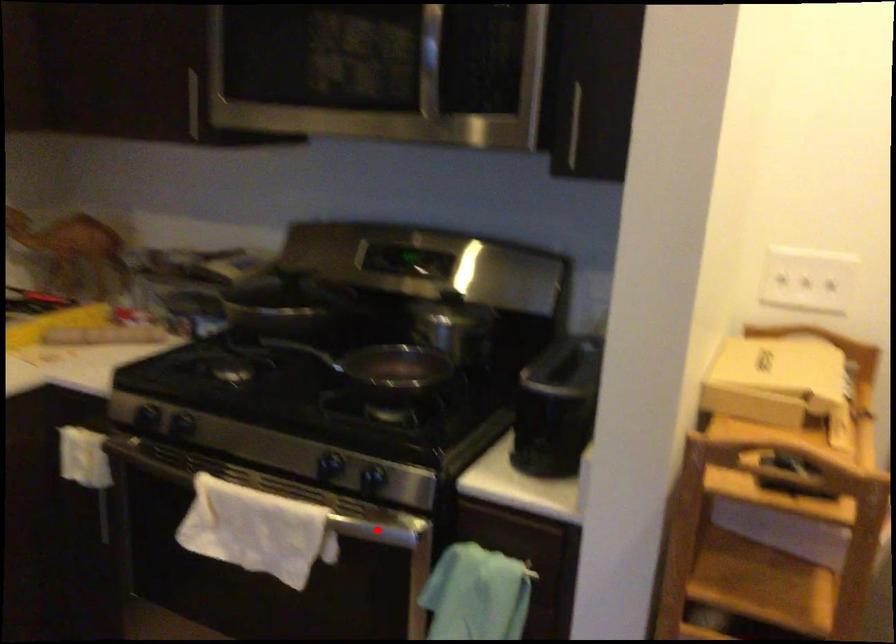
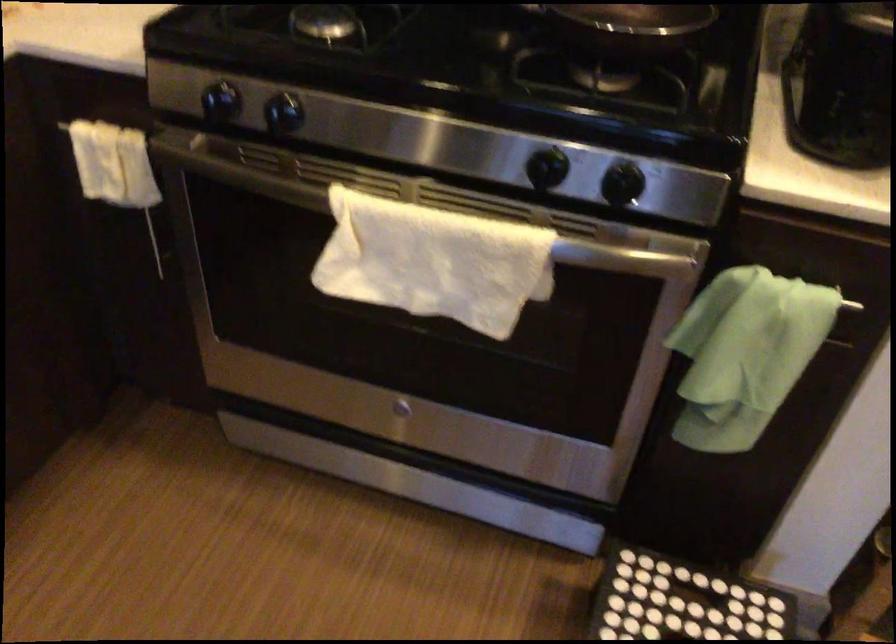
Question: A red point is marked in image1. In image2, is the corresponding 3D point closer to the camera or farther? Reply with the corresponding letter.

Choices:
 (A) The corresponding 3D point is closer.
 (B) The corresponding 3D point is farther.

Answer: (A)